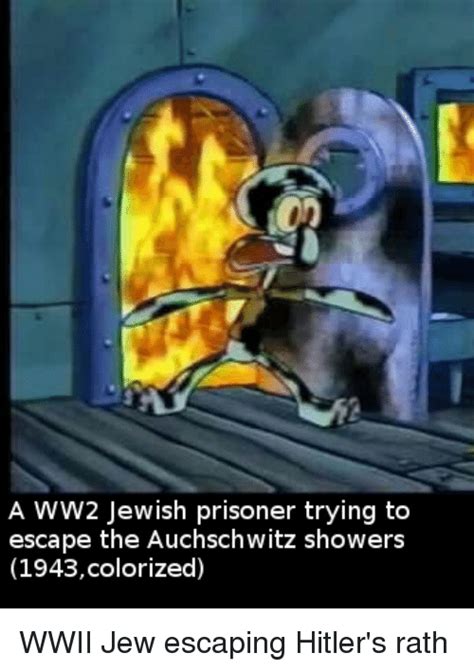
This screenshot has height=671, width=474. I want to click on floor, so click(x=160, y=482).